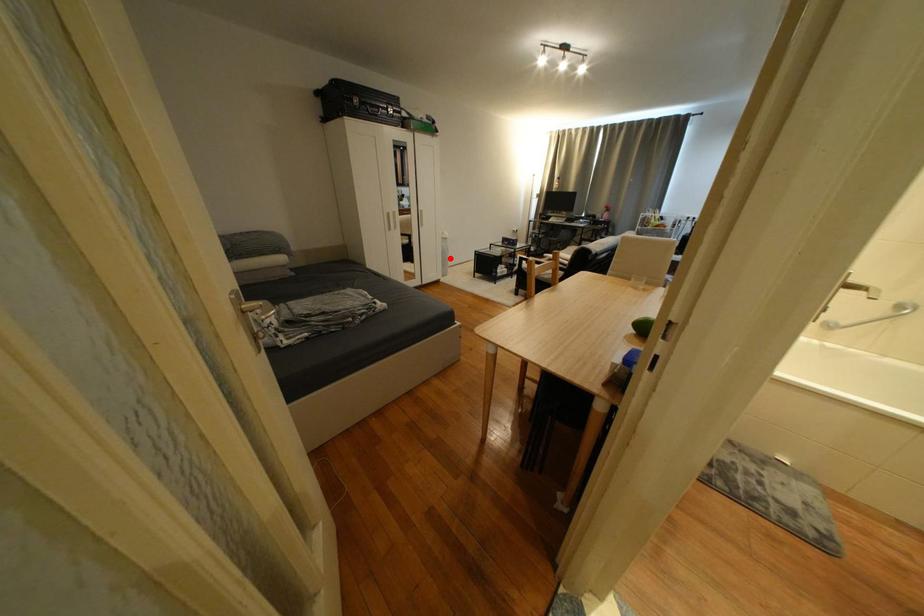
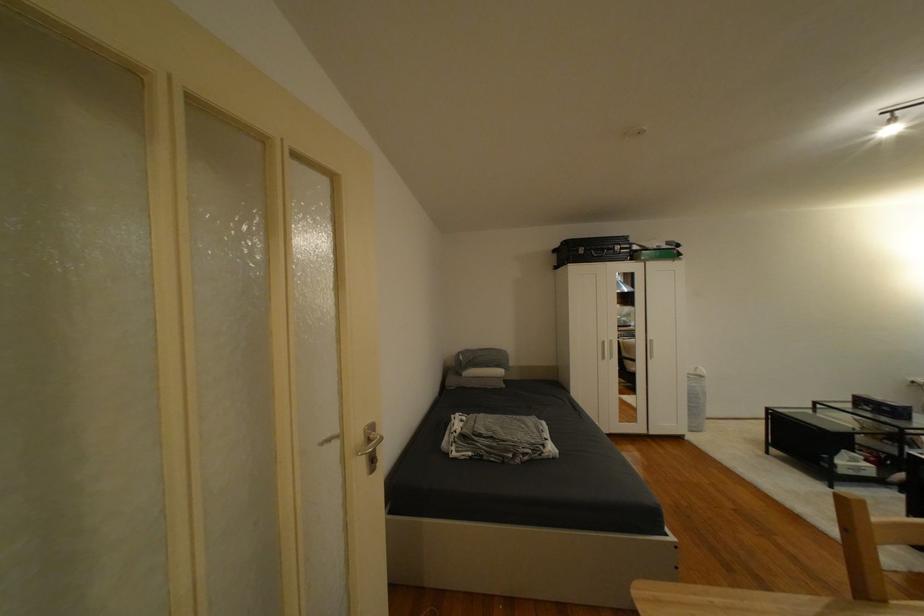
Question: I am providing you with two images of the same scene from different viewpoints. Image1 has a red point marked. In image2, the corresponding 3D location appears at what relative position? Reply with the corresponding letter.

Choices:
 (A) Closer
 (B) Farther

Answer: (B)